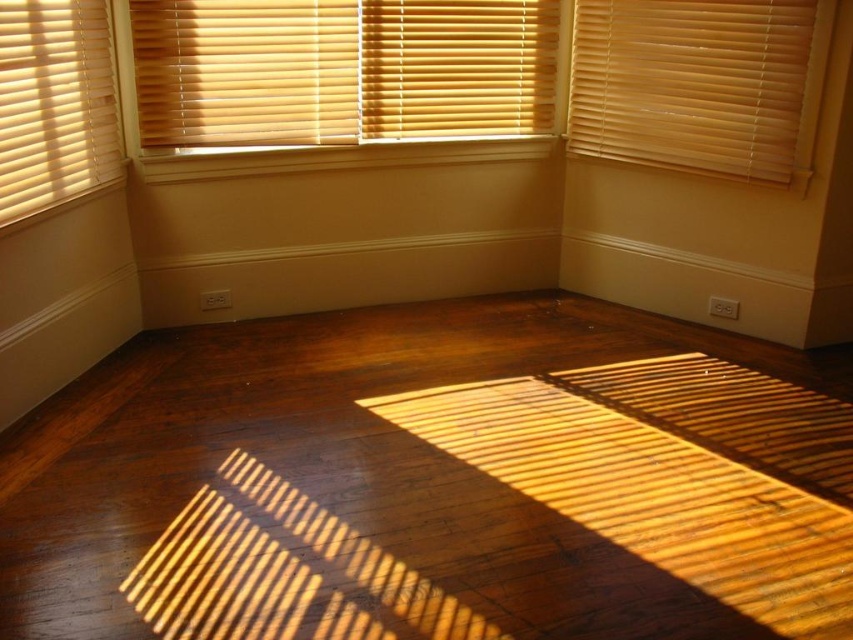
You are standing in the room and want to adjust the height of the wooden blinds at upper right and beige wood blinds at left to make them equal. Which blinds should you raise or lower, and by how much?

The wooden blinds at upper right is shorter than beige wood blinds at left. To make them equal, you should raise the wooden blinds at upper right to match the height of the beige wood blinds at left.

From the picture: You are a window cleaner who needs to clean the wooden blinds at upper center and wooden blinds at upper right. Which set of blinds is located higher up in the room?

The wooden blinds at upper center is positioned over the wooden blinds at upper right, so it is higher up in the room.

You are standing in the corner of the room depicted in the scene. There is a point marked at coordinates (x=695, y=83). Which object in the room does this point correspond to?

The point at coordinates (x=695, y=83) corresponds to the wooden blinds at upper right.